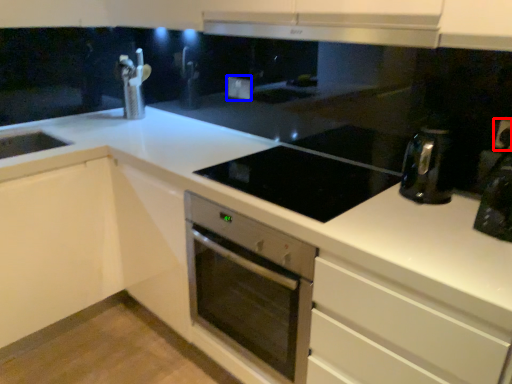
Question: Among these objects, which one is farthest to the camera, electric outlet (highlighted by a red box) or electric outlet (highlighted by a blue box)?

Choices:
 (A) electric outlet
 (B) electric outlet

Answer: (B)